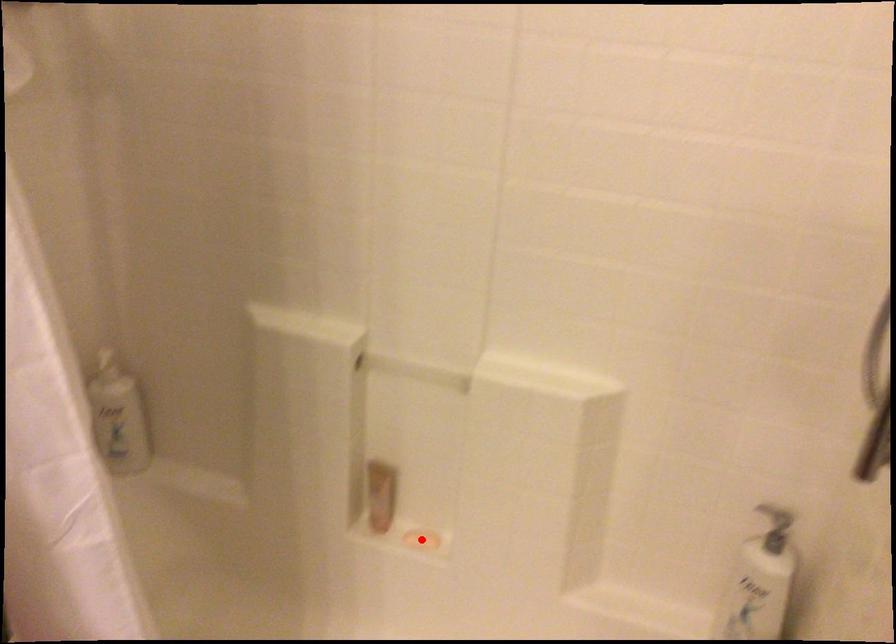
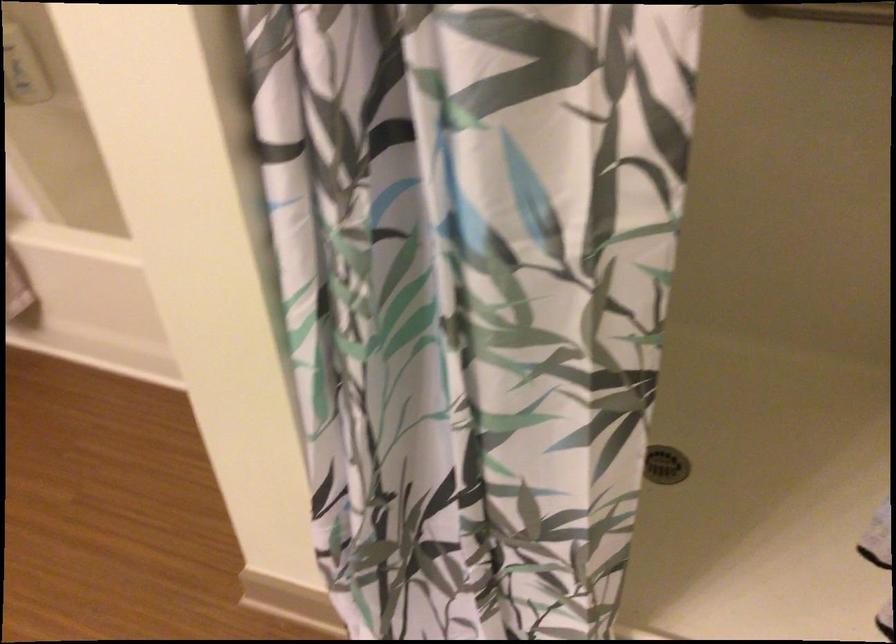
Question: I am providing you with two images of the same scene from different viewpoints. A red point is marked on the first image. Can you still see the location of the red point in image 2?

Choices:
 (A) Yes
 (B) No

Answer: (B)